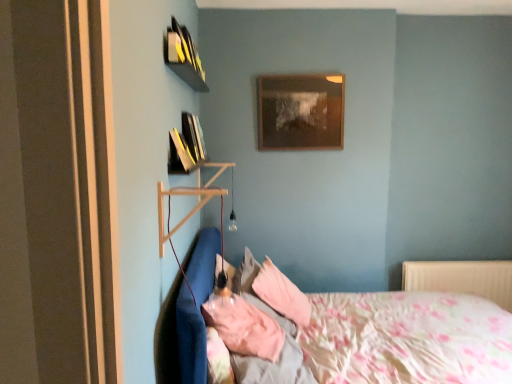
Question: Is yellow matte book at upper left, which appears as the 1th book when viewed from the top, in contact with pink fabric pillow at center, the 2th pillow viewed from the back?

Choices:
 (A) no
 (B) yes

Answer: (A)

Question: Does yellow matte book at upper left, the second book from the bottom, appear on the left side of pink fabric pillow at center, positioned as the first pillow in front-to-back order?

Choices:
 (A) no
 (B) yes

Answer: (B)

Question: From the image's perspective, does yellow matte book at upper left, which appears as the 1th book when viewed from the top, appear lower than pink fabric pillow at center, the 2th pillow viewed from the back?

Choices:
 (A) yes
 (B) no

Answer: (B)

Question: Does yellow matte book at upper left, the second book from the bottom, have a greater width compared to pink fabric pillow at center, positioned as the first pillow in front-to-back order?

Choices:
 (A) no
 (B) yes

Answer: (A)

Question: Does yellow matte book at upper left, the second book from the bottom, have a smaller size compared to pink fabric pillow at center, the 2th pillow viewed from the back?

Choices:
 (A) no
 (B) yes

Answer: (B)

Question: Is hardcover books at upper left, which ranks as the 2th book in top-to-bottom order, spatially inside pink fabric pillow at center, positioned as the first pillow in front-to-back order, or outside of it?

Choices:
 (A) outside
 (B) inside

Answer: (A)

Question: From a real-world perspective, is hardcover books at upper left, which ranks as the 1th book in bottom-to-top order, above or below pink fabric pillow at center, positioned as the first pillow in front-to-back order?

Choices:
 (A) above
 (B) below

Answer: (A)

Question: In terms of height, does hardcover books at upper left, which ranks as the 1th book in bottom-to-top order, look taller or shorter compared to pink fabric pillow at center, positioned as the first pillow in front-to-back order?

Choices:
 (A) short
 (B) tall

Answer: (B)

Question: Is hardcover books at upper left, which ranks as the 1th book in bottom-to-top order, bigger or smaller than pink fabric pillow at center, the 2th pillow viewed from the back?

Choices:
 (A) small
 (B) big

Answer: (B)

Question: Would you say wooden picture frame at upper center is to the left or to the right of fluffy cotton bed at lower left in the picture?

Choices:
 (A) right
 (B) left

Answer: (B)

Question: Is wooden picture frame at upper center inside the boundaries of fluffy cotton bed at lower left, or outside?

Choices:
 (A) inside
 (B) outside

Answer: (B)

Question: From the image's perspective, is wooden picture frame at upper center above or below fluffy cotton bed at lower left?

Choices:
 (A) above
 (B) below

Answer: (A)

Question: Is wooden picture frame at upper center taller or shorter than fluffy cotton bed at lower left?

Choices:
 (A) tall
 (B) short

Answer: (B)

Question: Is white plastic radiator at lower right inside the boundaries of wooden picture frame at upper center, or outside?

Choices:
 (A) outside
 (B) inside

Answer: (A)

Question: From a real-world perspective, is white plastic radiator at lower right above or below wooden picture frame at upper center?

Choices:
 (A) below
 (B) above

Answer: (A)